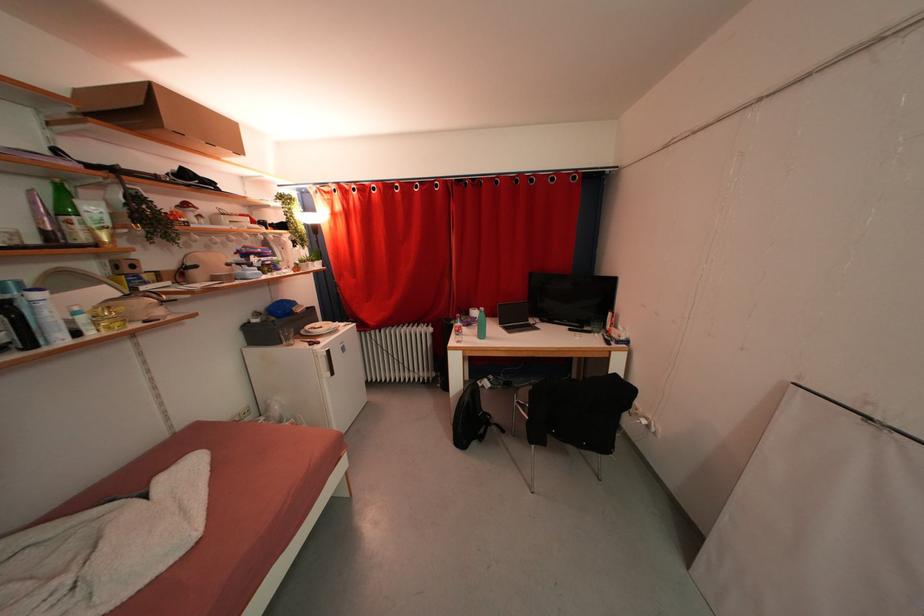
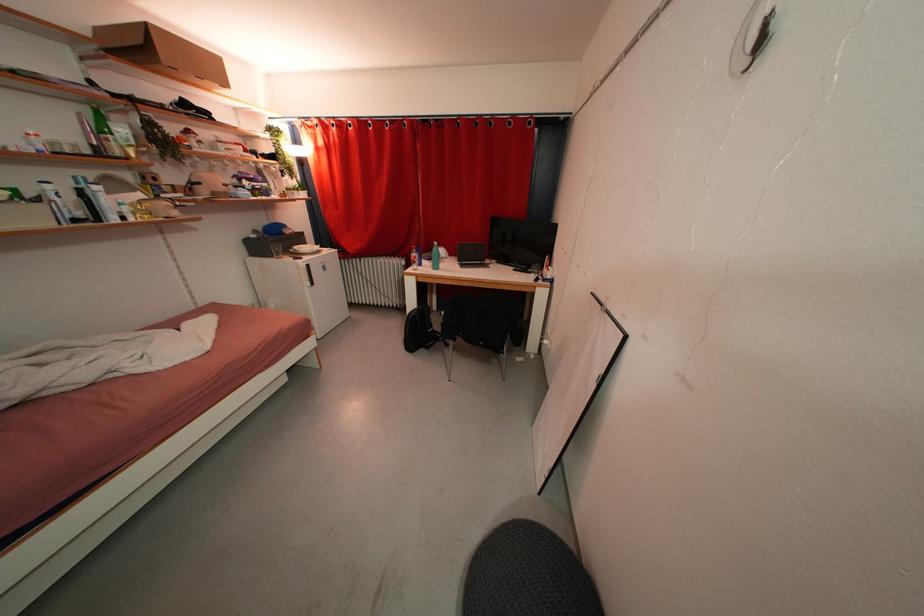
Find the pixel in the second image that matches the point at 226,137 in the first image.

(214, 71)